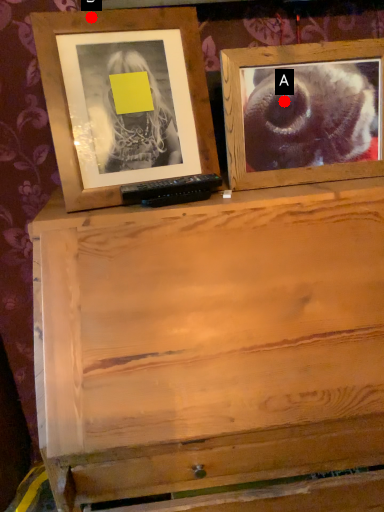
Question: Two points are circled on the image, labeled by A and B beside each circle. Which of the following is the closest to the observer?

Choices:
 (A) A is closer
 (B) B is closer

Answer: (B)